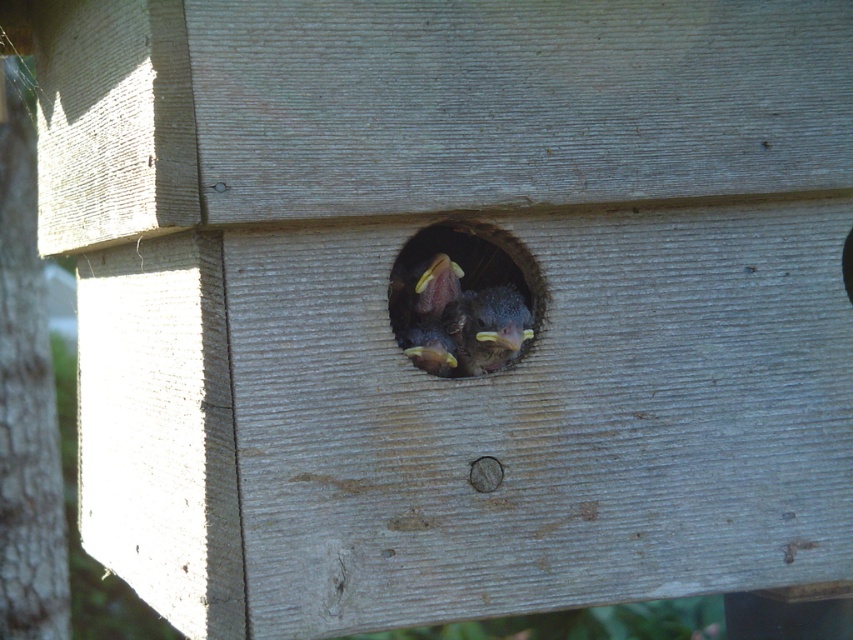
Measure the distance from smooth wood hole at center to smooth brown bird at center.

smooth wood hole at center is 1.20 inches from smooth brown bird at center.

Is smooth wood hole at center below smooth brown bird at center?

Incorrect, smooth wood hole at center is not positioned below smooth brown bird at center.

Which is in front, point (497, 314) or point (511, 326)?

Positioned in front is point (511, 326).

Locate an element on the screen. The image size is (853, 640). smooth wood hole at center is located at coordinates (457, 301).